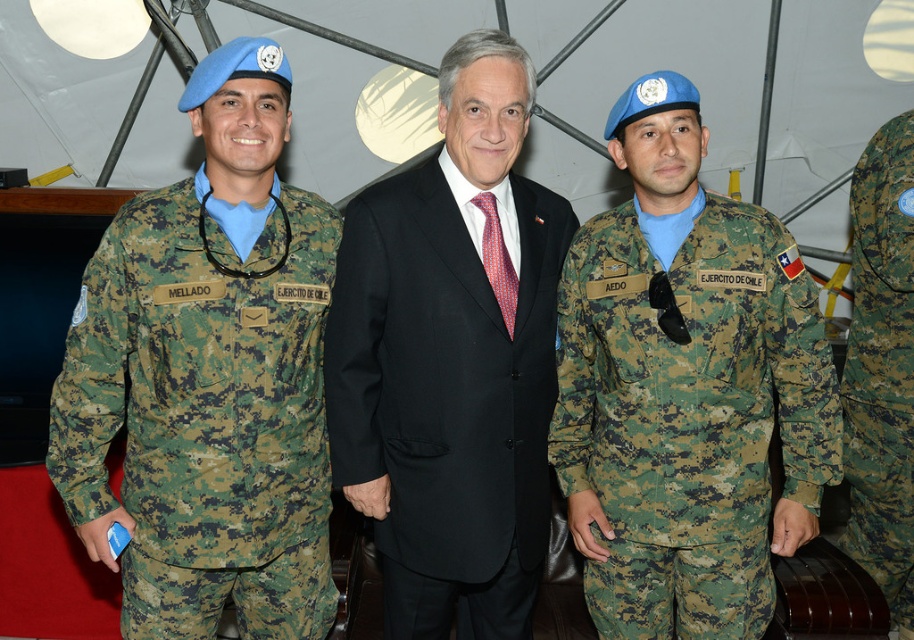
Can you confirm if camouflage fabric uniform at left is shorter than camouflagetextured fabric at right?

Yes.

Who is shorter, camouflage fabric uniform at left or camouflagetextured fabric at right?

With less height is camouflage fabric uniform at left.

Find the location of a particular element. The width and height of the screenshot is (914, 640). camouflage fabric uniform at left is located at coordinates (205, 413).

Which is more to the right, black matte suit at center or camouflagetextured fabric at right?

Positioned to the right is camouflagetextured fabric at right.

Can you confirm if black matte suit at center is taller than camouflagetextured fabric at right?

Incorrect, black matte suit at center's height is not larger of camouflagetextured fabric at right's.

Which is in front, point (364, 470) or point (877, 529)?

Point (364, 470) is in front.

What are the coordinates of `black matte suit at center` in the screenshot? It's located at (445, 400).

Between camouflage fabric uniform at center and black matte suit at center, which one appears on the right side from the viewer's perspective?

camouflage fabric uniform at center

Does camouflage fabric uniform at center have a greater height compared to black matte suit at center?

In fact, camouflage fabric uniform at center may be shorter than black matte suit at center.

Is point (745, 262) closer to viewer compared to point (471, 467)?

No, (745, 262) is further to viewer.

Locate an element on the screen. The height and width of the screenshot is (640, 914). camouflage fabric uniform at center is located at coordinates (689, 413).